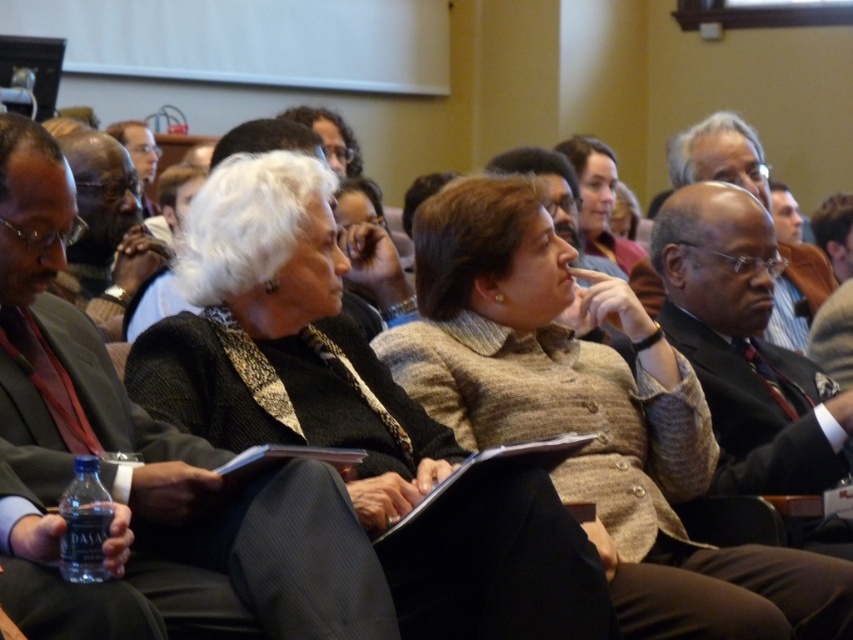
You are organizing a presentation and need to place a 15 cm tall model of a sculpture on the desk. The desk has the matte black clipboard at center and the matte black jacket at center on it. Can the sculpture fit on the desk without overlapping either object?

The matte black jacket at center is taller than the matte black clipboard at center. Since the sculpture is 15 cm tall, it can fit on the desk as long as there is enough space between the two objects. However, the exact placement depends on the distance between them, which isn